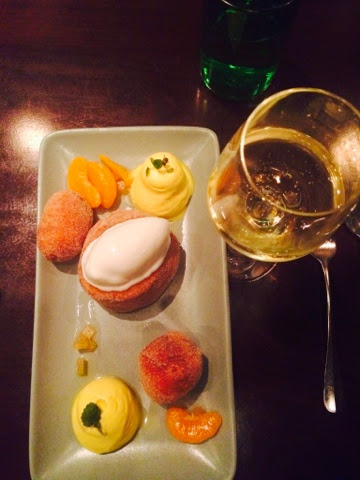
This screenshot has width=360, height=480. I want to click on table, so click(x=266, y=318).